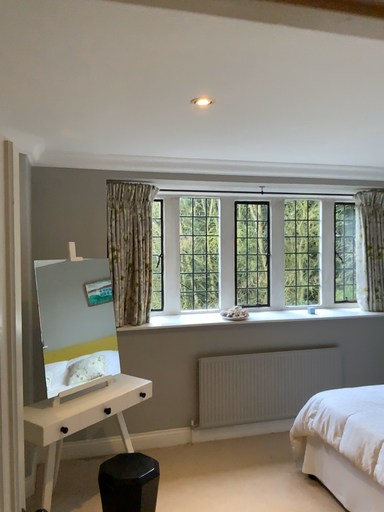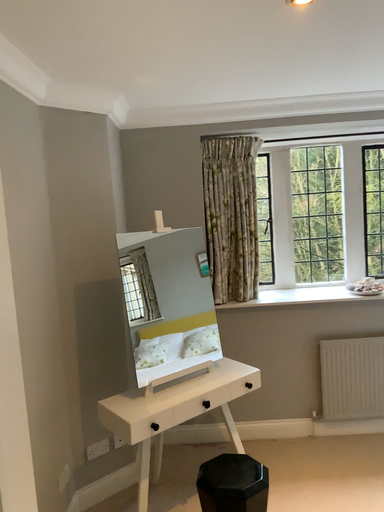
Question: How did the camera likely rotate when shooting the video?

Choices:
 (A) rotated left
 (B) rotated right

Answer: (A)